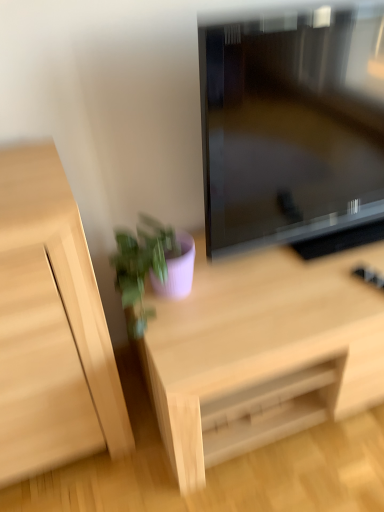
The height and width of the screenshot is (512, 384). Find the location of `free spot to the right of matte purple pot at lower center`. free spot to the right of matte purple pot at lower center is located at coordinates (240, 291).